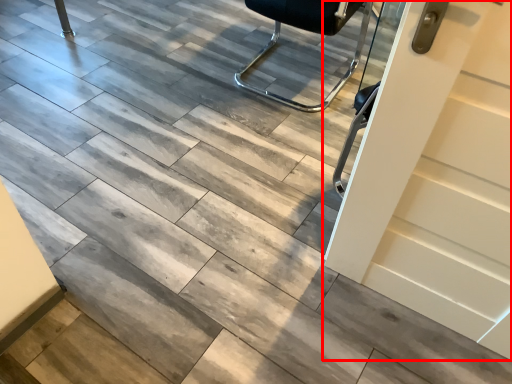
Question: From the image's perspective, what is the correct spatial relationship of door (annotated by the red box) in relation to chair?

Choices:
 (A) below
 (B) above

Answer: (A)